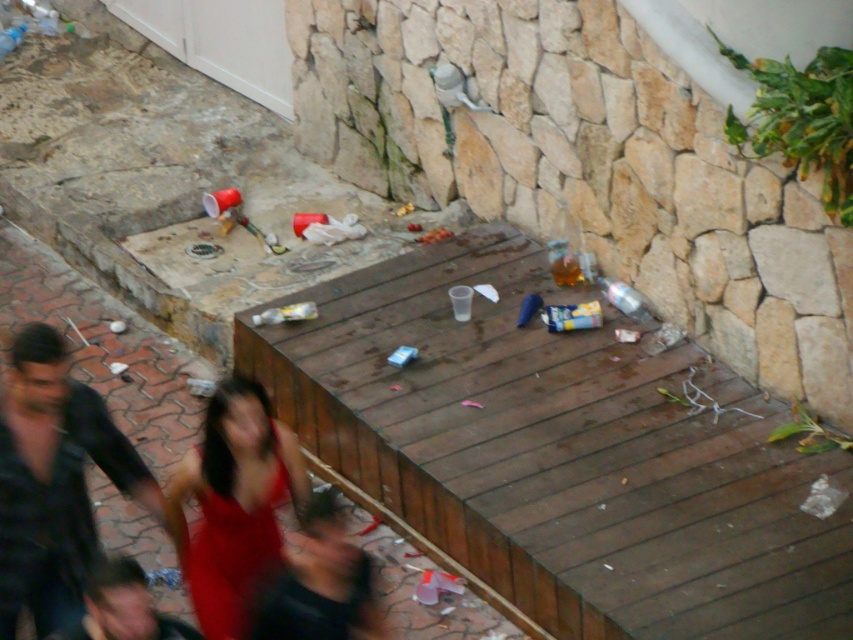
Does point (85, 397) lie in front of point (311, 508)?

No.

Image resolution: width=853 pixels, height=640 pixels. What do you see at coordinates (54, 481) in the screenshot? I see `dark blue shirt at lower left` at bounding box center [54, 481].

Does point (57, 388) come in front of point (370, 573)?

No.

This screenshot has width=853, height=640. I want to click on dark blue shirt at lower left, so click(x=54, y=481).

Which is below, dark blue shirt at lower left or smooth black shirt at lower left?

smooth black shirt at lower left is below.

Is point (125, 483) closer to camera compared to point (126, 563)?

No, (125, 483) is further to viewer.

Find the location of `dark blue shirt at lower left`. dark blue shirt at lower left is located at coordinates (54, 481).

Between point (206, 611) and point (306, 540), which one is positioned in front?

Positioned in front is point (306, 540).

Can you confirm if red satin dress at lower center is positioned to the right of dark brown leather jacket at lower center?

Incorrect, red satin dress at lower center is not on the right side of dark brown leather jacket at lower center.

Measure the distance between point (212,592) and camera.

Point (212,592) is 6.19 meters from camera.

Locate an element on the screen. Image resolution: width=853 pixels, height=640 pixels. red satin dress at lower center is located at coordinates (233, 502).